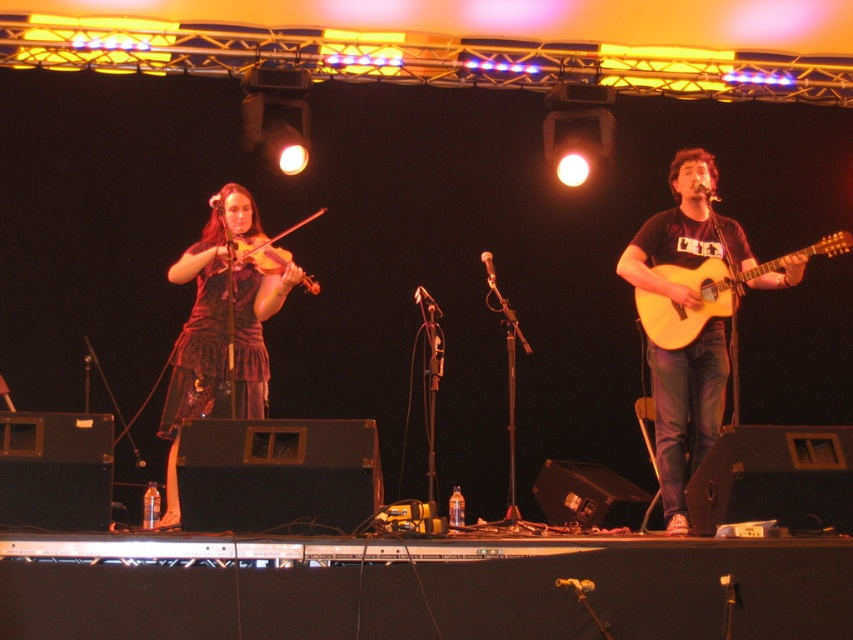
You are sitting in the audience and want to know which of the two points, point (709,195) or point (212,208), is closer to you. Based on the stage setup, can you determine which point is nearer?

Point (709,195) is closer to the viewer than point (212,208), so the first point is nearer.

You are a stagehand who needs to adjust the lighting for the performance. The spotlight needs to be moved from the wooden violin at center to the metallic silver microphone at center. Based on their positions, which direction should you move the spotlight?

The wooden violin at center is positioned on the left side of the metallic silver microphone at center. So, you should move the spotlight to the right to shift it from the violin to the microphone.